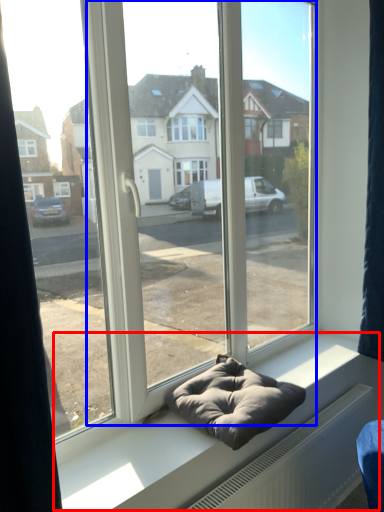
Question: Which object is closer to the camera taking this photo, window sill (highlighted by a red box) or glass door (highlighted by a blue box)?

Choices:
 (A) window sill
 (B) glass door

Answer: (B)